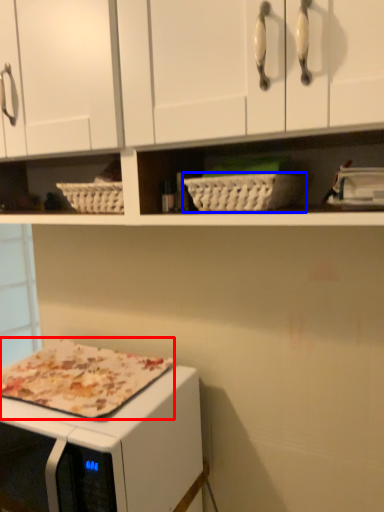
Question: Which point is further to the camera, pizza (highlighted by a red box) or basket (highlighted by a blue box)?

Choices:
 (A) pizza
 (B) basket

Answer: (A)